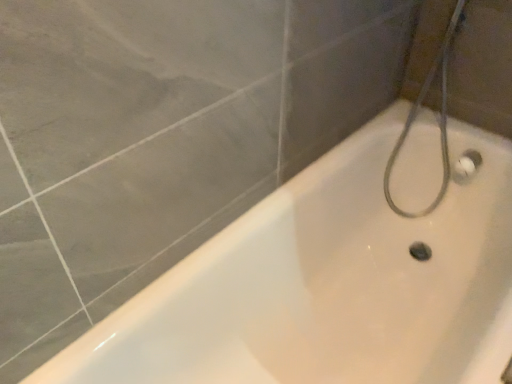
What do you see at coordinates (439, 121) in the screenshot? I see `white rubber hose at upper right` at bounding box center [439, 121].

Where is `white rubber hose at upper right`? The width and height of the screenshot is (512, 384). white rubber hose at upper right is located at coordinates (439, 121).

What is the approximate width of white rubber hose at upper right?

It is 10.26 inches.

What is the approximate height of white rubber hose at upper right?

white rubber hose at upper right is 32.33 inches tall.

At what (x,y) coordinates should I click in order to perform the action: click on white glossy bathtub at center. Please return your answer as a coordinate pair (x, y). Looking at the image, I should click on (327, 285).

The height and width of the screenshot is (384, 512). What do you see at coordinates (327, 285) in the screenshot? I see `white glossy bathtub at center` at bounding box center [327, 285].

At what (x,y) coordinates should I click in order to perform the action: click on white rubber hose at upper right. Please return your answer as a coordinate pair (x, y). This screenshot has width=512, height=384. Looking at the image, I should click on (439, 121).

Which object is positioned more to the left, white rubber hose at upper right or white glossy bathtub at center?

Positioned to the left is white glossy bathtub at center.

Who is more distant, white rubber hose at upper right or white glossy bathtub at center?

white rubber hose at upper right is further away from the camera.

Is point (441, 76) positioned in front of point (433, 132)?

Yes, it is in front of point (433, 132).

From the image's perspective, is white rubber hose at upper right over white glossy bathtub at center?

Yes, from the image's perspective, white rubber hose at upper right is over white glossy bathtub at center.

From a real-world perspective, is white rubber hose at upper right under white glossy bathtub at center?

No, from a real-world perspective, white rubber hose at upper right is not below white glossy bathtub at center.

Is white rubber hose at upper right thinner than white glossy bathtub at center?

Indeed, white rubber hose at upper right has a lesser width compared to white glossy bathtub at center.

Considering the sizes of white rubber hose at upper right and white glossy bathtub at center in the image, is white rubber hose at upper right taller or shorter than white glossy bathtub at center?

Clearly, white rubber hose at upper right is taller compared to white glossy bathtub at center.

Who is bigger, white rubber hose at upper right or white glossy bathtub at center?

white glossy bathtub at center.

Is white rubber hose at upper right inside or outside of white glossy bathtub at center?

white rubber hose at upper right is spatially positioned inside white glossy bathtub at center.

Is the surface of white rubber hose at upper right in direct contact with white glossy bathtub at center?

No, white rubber hose at upper right is not touching white glossy bathtub at center.

Is white rubber hose at upper right oriented away from white glossy bathtub at center?

white rubber hose at upper right does not have its back to white glossy bathtub at center.

Can you tell me how much white rubber hose at upper right and white glossy bathtub at center differ in facing direction?

There is a 25.8-degree angle between the facing directions of white rubber hose at upper right and white glossy bathtub at center.

How much distance is there between white rubber hose at upper right and white glossy bathtub at center?

The distance of white rubber hose at upper right from white glossy bathtub at center is 16.97 inches.

Locate an element on the screen. The width and height of the screenshot is (512, 384). bathtub below the white rubber hose at upper right (from a real-world perspective) is located at coordinates (327, 285).

Based on their positions, is white glossy bathtub at center located to the left or right of white rubber hose at upper right?

white glossy bathtub at center is to the left of white rubber hose at upper right.

Does white glossy bathtub at center come in front of white rubber hose at upper right?

Yes.

Which point is more forward, (88, 335) or (453, 14)?

The point (88, 335) is more forward.

Looking at this image, from the image's perspective, which object appears higher, white glossy bathtub at center or white rubber hose at upper right?

white rubber hose at upper right is shown above in the image.

From a real-world perspective, who is located lower, white glossy bathtub at center or white rubber hose at upper right?

From a 3D spatial view, white glossy bathtub at center is below.

Looking at their sizes, would you say white glossy bathtub at center is wider or thinner than white rubber hose at upper right?

white glossy bathtub at center is wider than white rubber hose at upper right.

Between white glossy bathtub at center and white rubber hose at upper right, which one has more height?

white rubber hose at upper right is taller.

Between white glossy bathtub at center and white rubber hose at upper right, which one has smaller size?

white rubber hose at upper right is smaller.

Looking at this image, would you say white glossy bathtub at center is inside or outside white rubber hose at upper right?

white glossy bathtub at center is located beyond the bounds of white rubber hose at upper right.

Is the surface of white glossy bathtub at center in direct contact with white rubber hose at upper right?

No, white glossy bathtub at center is not touching white rubber hose at upper right.

Is white glossy bathtub at center looking in the opposite direction of white rubber hose at upper right?

white glossy bathtub at center does not have its back to white rubber hose at upper right.

How different are the orientations of white glossy bathtub at center and white rubber hose at upper right in degrees?

They differ by 25.8 degrees in their facing directions.

Find the location of `bathtub below the white rubber hose at upper right (from the image's perspective)`. bathtub below the white rubber hose at upper right (from the image's perspective) is located at coordinates (327, 285).

At what (x,y) coordinates should I click in order to perform the action: click on shower on the right of white glossy bathtub at center. Please return your answer as a coordinate pair (x, y). Image resolution: width=512 pixels, height=384 pixels. Looking at the image, I should click on (439, 121).

Find the location of `bathtub in front of the white rubber hose at upper right`. bathtub in front of the white rubber hose at upper right is located at coordinates (327, 285).